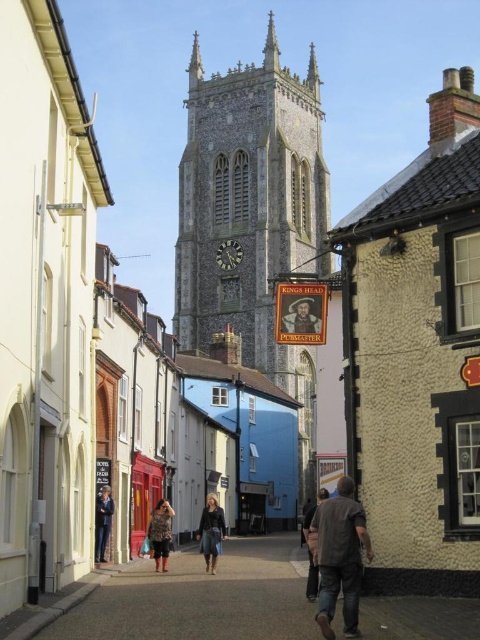
You are standing on the street looking at the smooth stone clock tower at center and the dark brown leather jacket at center. Which object is higher in the scene?

The smooth stone clock tower at center is higher than the dark brown leather jacket at center.